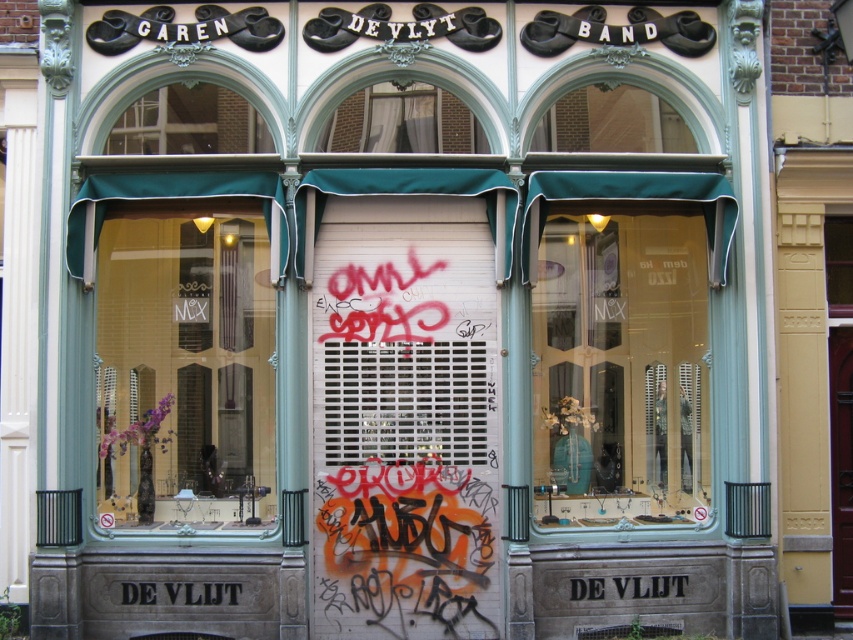
Question: Which is farther from the black wood sign at center?

Choices:
 (A) matte glass window at center
 (B) matte glass jewelry display at center

Answer: (A)

Question: Is matte glass window at center below matte glass jewelry display at center?

Choices:
 (A) yes
 (B) no

Answer: (A)

Question: Can you confirm if matte glass jewelry display at center is positioned below black wood sign at center?

Choices:
 (A) no
 (B) yes

Answer: (A)

Question: From the image, what is the correct spatial relationship of matte glass jewelry display at center in relation to transparent glass window at center?

Choices:
 (A) below
 (B) above

Answer: (A)

Question: Considering the real-world distances, which object is closest to the black wood sign at center?

Choices:
 (A) transparent glass window at center
 (B) matte glass jewelry display at center
 (C) matte glass window at center

Answer: (B)

Question: Which object is closer to the camera taking this photo?

Choices:
 (A) transparent glass window at center
 (B) black wood sign at center
 (C) matte glass jewelry display at center

Answer: (B)